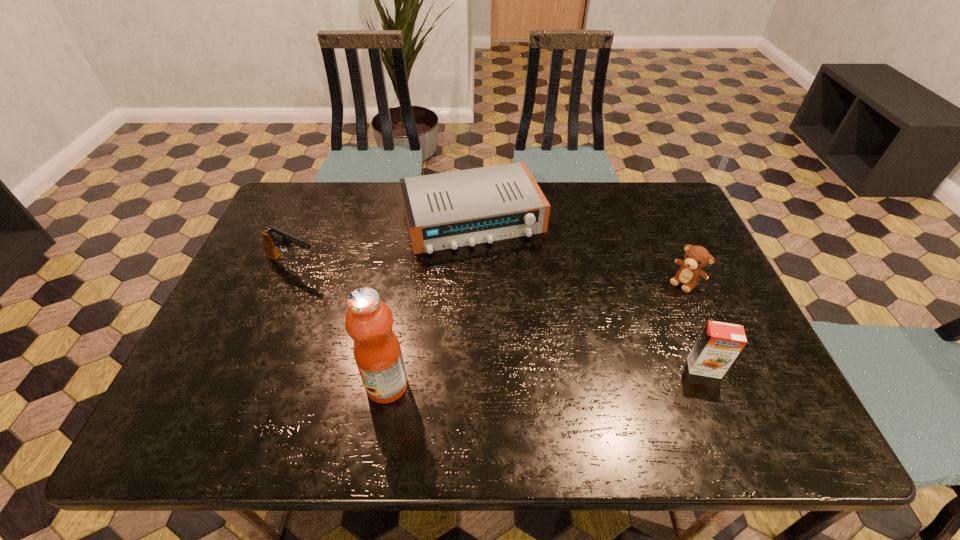
At what (x,y) coordinates should I click in order to perform the action: click on fruit juice. Please return your answer as a coordinate pair (x, y). Looking at the image, I should click on [369, 321].

I want to click on orange juice, so click(719, 344).

This screenshot has height=540, width=960. I want to click on teddy bear, so click(696, 257).

Locate an element on the screen. radio receiver is located at coordinates (446, 210).

Where is `the leftmost object`? This screenshot has width=960, height=540. the leftmost object is located at coordinates (272, 237).

Where is `blank area located on the front label of the tallest object`? The width and height of the screenshot is (960, 540). blank area located on the front label of the tallest object is located at coordinates (245, 386).

Locate an element on the screen. This screenshot has width=960, height=540. vacant region located 0.330m on the front label of the tallest object is located at coordinates [x=212, y=386].

Locate an element on the screen. The image size is (960, 540). free space located on the front label of the tallest object is located at coordinates (207, 386).

The width and height of the screenshot is (960, 540). I want to click on vacant region located 0.250m on the back of the orange juice, so click(x=667, y=278).

Image resolution: width=960 pixels, height=540 pixels. In order to click on vacant space located 0.180m on the face of the teddy bear in this screenshot , I will do [x=637, y=328].